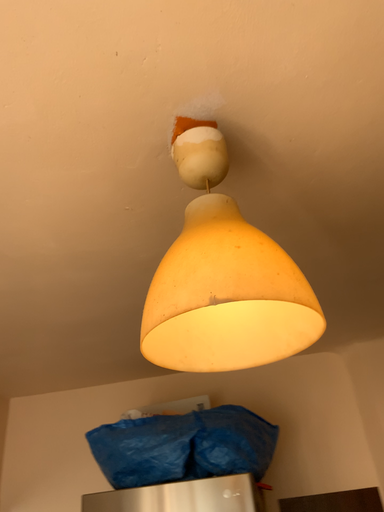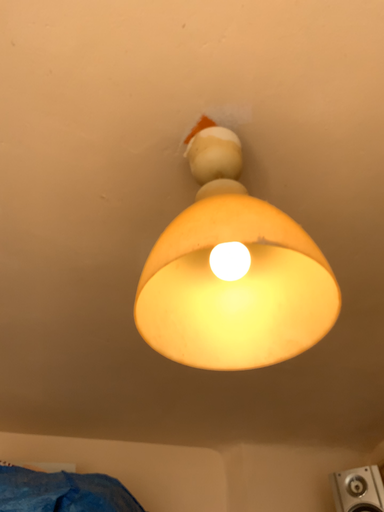
Question: Which way did the camera rotate in the video?

Choices:
 (A) rotated downward
 (B) rotated upward

Answer: (B)